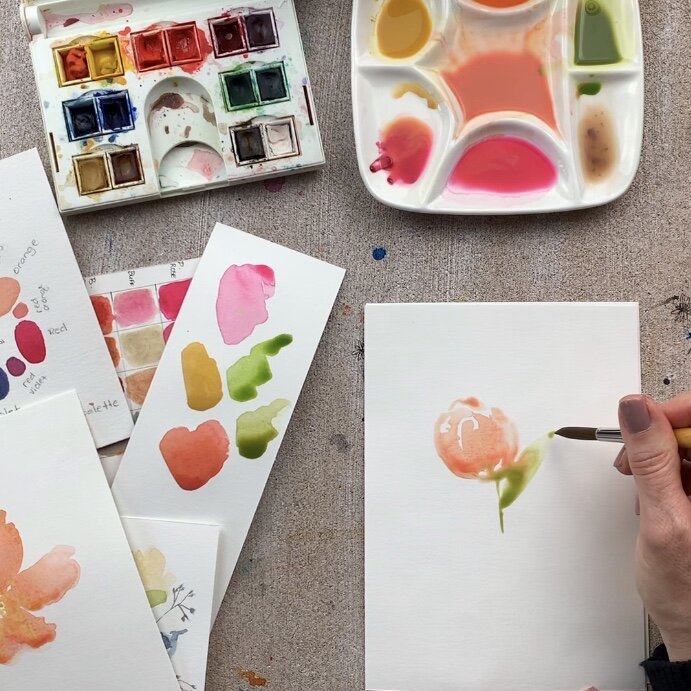
Locate an element on the screen. white tray is located at coordinates (413, 79).